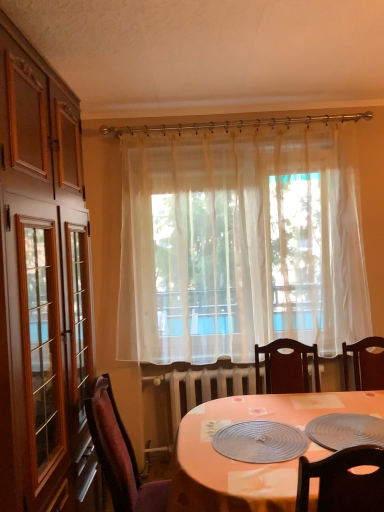
Question: Is there a large distance between metallic silver platter at lower right, which is the 1th platter in right-to-left order, and sheer white curtain at center?

Choices:
 (A) no
 (B) yes

Answer: (B)

Question: Is the surface of metallic silver platter at lower right, the 2th platter from the left, in direct contact with sheer white curtain at center?

Choices:
 (A) no
 (B) yes

Answer: (A)

Question: Is metallic silver platter at lower right, which is the 1th platter in right-to-left order, to the left of sheer white curtain at center from the viewer's perspective?

Choices:
 (A) yes
 (B) no

Answer: (B)

Question: Does metallic silver platter at lower right, which is the 1th platter in right-to-left order, lie behind sheer white curtain at center?

Choices:
 (A) no
 (B) yes

Answer: (A)

Question: Would you say metallic silver platter at lower right, which is the 1th platter in right-to-left order, contains sheer white curtain at center?

Choices:
 (A) yes
 (B) no

Answer: (B)

Question: Considering the relative sizes of metallic silver platter at lower right, which is the 1th platter in right-to-left order, and sheer white curtain at center in the image provided, is metallic silver platter at lower right, which is the 1th platter in right-to-left order, taller than sheer white curtain at center?

Choices:
 (A) yes
 (B) no

Answer: (B)

Question: Is metallic textured platter at center, the 1th platter when ordered from left to right, positioned with its back to velvet burgundy chair at lower left?

Choices:
 (A) no
 (B) yes

Answer: (A)

Question: Is metallic textured platter at center, which is the 2th platter from right to left, shorter than velvet burgundy chair at lower left?

Choices:
 (A) no
 (B) yes

Answer: (B)

Question: Can you confirm if metallic textured platter at center, which is the 2th platter from right to left, is positioned to the left of velvet burgundy chair at lower left?

Choices:
 (A) yes
 (B) no

Answer: (B)

Question: From a real-world perspective, is metallic textured platter at center, which is the 2th platter from right to left, below velvet burgundy chair at lower left?

Choices:
 (A) no
 (B) yes

Answer: (A)

Question: Is metallic textured platter at center, the 1th platter when ordered from left to right, far from velvet burgundy chair at lower left?

Choices:
 (A) no
 (B) yes

Answer: (A)

Question: Can you confirm if metallic textured platter at center, which is the 2th platter from right to left, is thinner than velvet burgundy chair at lower left?

Choices:
 (A) no
 (B) yes

Answer: (B)

Question: Is metallic textured platter at center, the 1th platter when ordered from left to right, to the left of metallic silver platter at lower right, the 2th platter from the left, from the viewer's perspective?

Choices:
 (A) no
 (B) yes

Answer: (B)